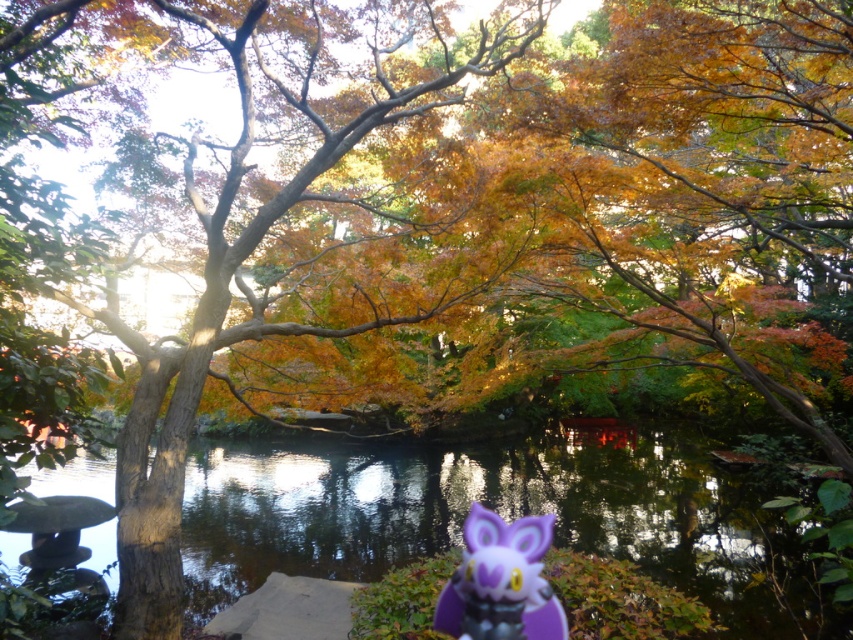
You are standing in the autumn park scene and want to place a new decorative item between the transparent water at center and the purple matte plush toy at lower center. Considering their sizes, which object should you place the item closer to?

Since the transparent water at center is larger than the purple matte plush toy at lower center, you should place the new decorative item closer to the purple matte plush toy at lower center to maintain balance in the composition.

You are a photographer trying to capture the purple matte plush toy at lower center and the transparent water at center in the same frame. Based on their positions, which object would appear closer to the camera?

The purple matte plush toy at lower center appears closer to the camera because it is positioned at lower center, while the transparent water at center is much taller, indicating it is further away.

You are a photographer standing in the autumnal scene. You want to take a photo of the transparent water at center and the purple matte plush toy at lower center. Which object should you focus on first if you want to capture both in sharp focus?

You should focus on the purple matte plush toy at lower center first because it is closer to you than the transparent water at center, which is further away. This way, both objects can be in sharp focus by adjusting the camera settings appropriately.